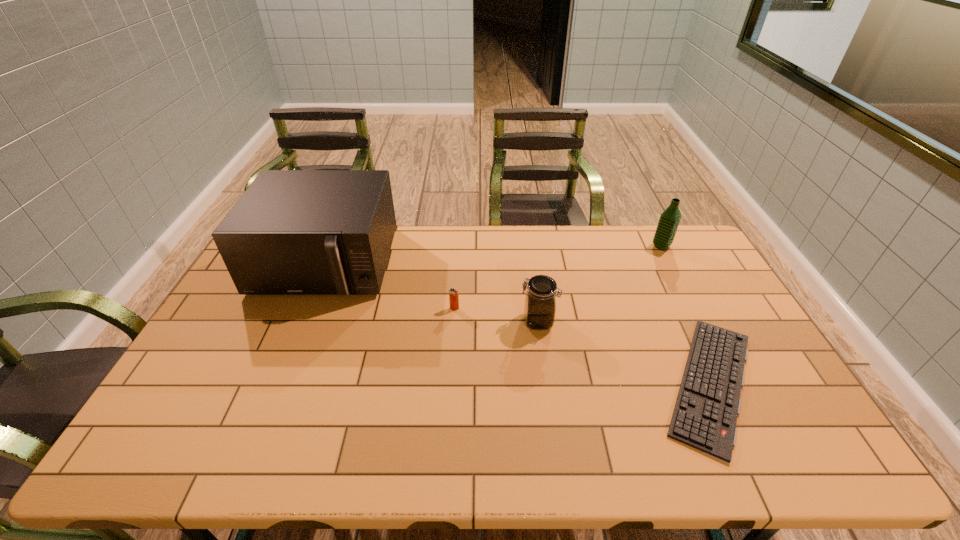
Identify the location of vacant area situated 0.190m on the lid of the jar. This screenshot has width=960, height=540. (458, 321).

This screenshot has height=540, width=960. Find the location of `vacant space situated on the lid of the jar`. vacant space situated on the lid of the jar is located at coordinates (465, 321).

The height and width of the screenshot is (540, 960). I want to click on free region located 0.370m on the lid of the jar, so [399, 321].

At what (x,y) coordinates should I click in order to perform the action: click on vacant space situated 0.270m on the front of the second object from left to right. Please return your answer as a coordinate pair (x, y). This screenshot has width=960, height=540. Looking at the image, I should click on (450, 381).

The width and height of the screenshot is (960, 540). Identify the location of free location located 0.200m on the left of the shortest object. (574, 383).

Find the location of a particular element. microwave oven that is at the far edge is located at coordinates (292, 232).

Where is `water bottle that is at the far edge`? Image resolution: width=960 pixels, height=540 pixels. water bottle that is at the far edge is located at coordinates (669, 220).

The height and width of the screenshot is (540, 960). Identify the location of object at the near edge. (705, 414).

Where is `object that is positioned at the left edge`? Image resolution: width=960 pixels, height=540 pixels. object that is positioned at the left edge is located at coordinates (292, 232).

Identify the location of water bottle at the right edge. The image size is (960, 540). (669, 220).